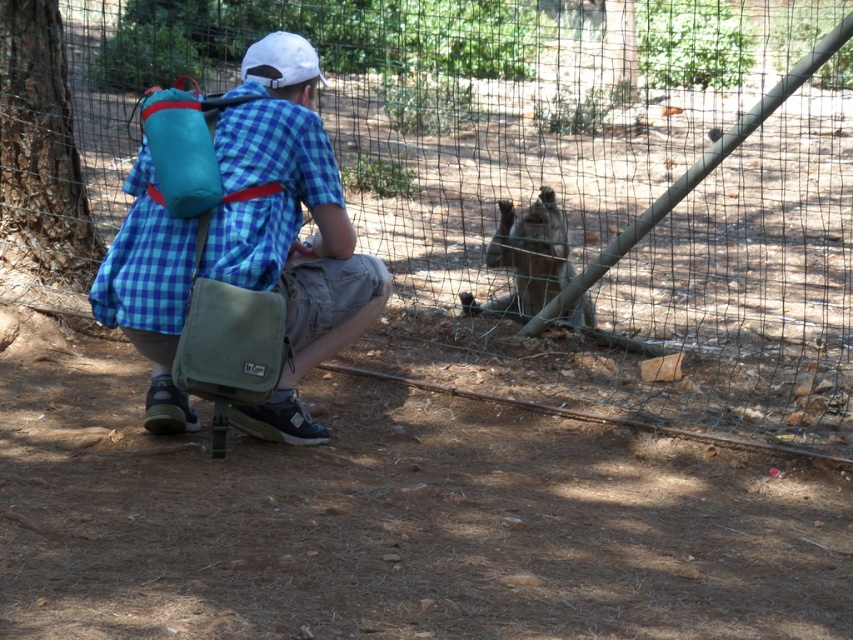
Question: Which point is farther from the camera taking this photo?

Choices:
 (A) (813, 291)
 (B) (206, 148)
 (C) (189, 368)
 (D) (560, 224)

Answer: (A)

Question: Which of the following is the closest to the observer?

Choices:
 (A) teal fabric backpack at upper left
 (B) green mesh fence at center
 (C) green canvas bag at center

Answer: (C)

Question: Can you confirm if green mesh fence at center is wider than green canvas bag at center?

Choices:
 (A) yes
 (B) no

Answer: (A)

Question: Is green mesh fence at center above green canvas bag at center?

Choices:
 (A) yes
 (B) no

Answer: (A)

Question: In this image, where is green canvas bag at center located relative to teal fabric backpack at upper left?

Choices:
 (A) right
 (B) left

Answer: (A)

Question: Which point is closer to the camera taking this photo?

Choices:
 (A) (173, 132)
 (B) (532, 291)

Answer: (A)